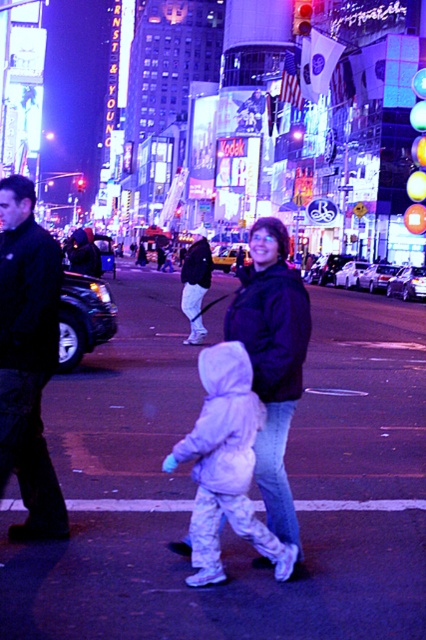
You are a photographer trying to capture a photo of the two people in the scene. The dark blue jacket at center and the white fleece jacket at center are both in your camera frame. Which jacket should you focus on first if you want to ensure both are in focus?

The dark blue jacket at center is above the white fleece jacket at center, so focusing on the dark blue jacket at center first would help ensure both are in focus since it is closer to the camera.

You are a photographer trying to capture both the dark blue jacket at left and the dark blue jacket at center in the same frame. Which jacket should you focus on first to ensure both are in the frame?

The dark blue jacket at left is smaller in size compared to the dark blue jacket at center, so you should focus on the larger dark blue jacket at center first to ensure both are in the frame.

You are a photographer trying to capture a candid shot of two people walking in the city at night. You notice the dark blue jacket at center and the white fleece jacket at center. Which jacket should you focus on to ensure the subject is taller in the frame?

The dark blue jacket at center has a greater height compared to the white fleece jacket at center, so focusing on the dark blue jacket at center will ensure the subject appears taller in the frame.